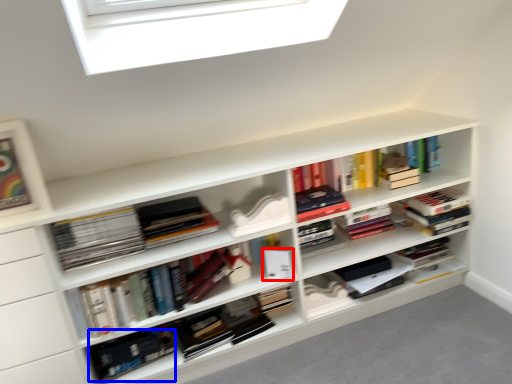
Question: Which of the following is the closest to the observer, paperback book (highlighted by a red box) or book (highlighted by a blue box)?

Choices:
 (A) paperback book
 (B) book

Answer: (B)